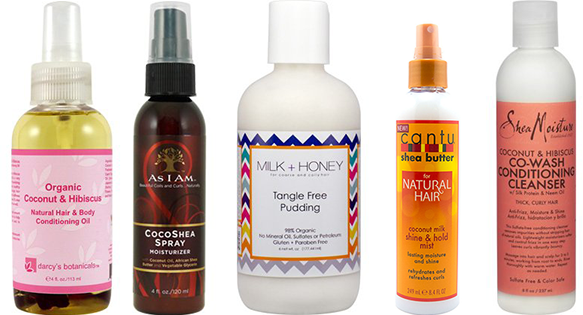
Image resolution: width=583 pixels, height=315 pixels. Find the location of `bottle`. bottle is located at coordinates (68, 229), (175, 232), (270, 229), (423, 223), (543, 219).